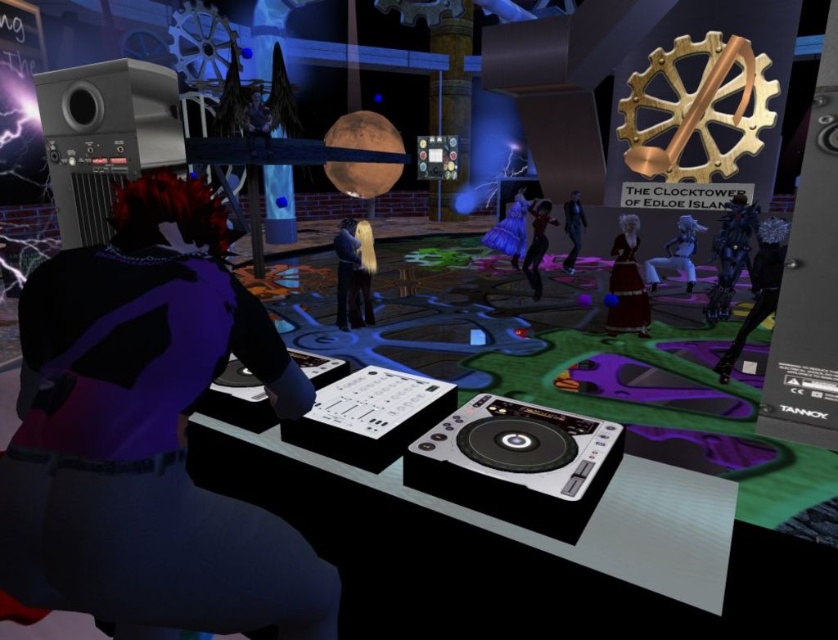
Question: Which of the following is the farthest from the observer?

Choices:
 (A) shiny black dress at right
 (B) shiny black dress at center

Answer: (B)

Question: Which point is closer to the camera taking this photo?

Choices:
 (A) (573, 241)
 (B) (649, 288)
 (C) (365, 301)

Answer: (C)

Question: Is blonde hair at center above shiny black dress at center?

Choices:
 (A) no
 (B) yes

Answer: (A)

Question: Does purple matte jacket at left come in front of blonde hair at center?

Choices:
 (A) no
 (B) yes

Answer: (B)

Question: Which of the following is the closest to the observer?

Choices:
 (A) (358, 234)
 (B) (528, 268)
 (C) (614, 272)
 (D) (685, 230)

Answer: (C)

Question: Is smooth black hair at center smaller than shiny black dress at center?

Choices:
 (A) yes
 (B) no

Answer: (A)